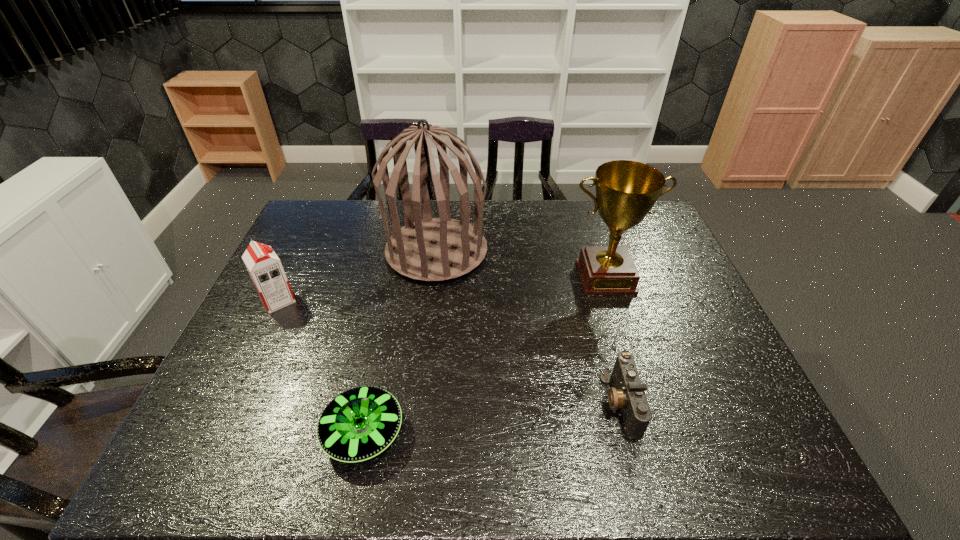
The image size is (960, 540). I want to click on blank space located 0.160m on the front-facing side of the camera, so click(536, 403).

In order to click on vacant position located 0.050m on the front-facing side of the camera in this screenshot , I will do `click(583, 403)`.

Find the location of a particular element. This screenshot has height=540, width=960. vacant space located on the back of the saucer is located at coordinates (381, 350).

Where is `object present at the far edge`? object present at the far edge is located at coordinates (430, 249).

Identify the location of camera present at the near edge. This screenshot has height=540, width=960. (628, 395).

This screenshot has width=960, height=540. I want to click on saucer positioned at the near edge, so click(x=358, y=424).

In order to click on object situated at the left edge in this screenshot , I will do `click(263, 265)`.

In order to click on object that is at the right edge in this screenshot , I will do `click(626, 191)`.

Locate an element on the screen. blank area at the far edge is located at coordinates (372, 206).

Where is `free space at the near edge of the desktop`? The image size is (960, 540). free space at the near edge of the desktop is located at coordinates (470, 449).